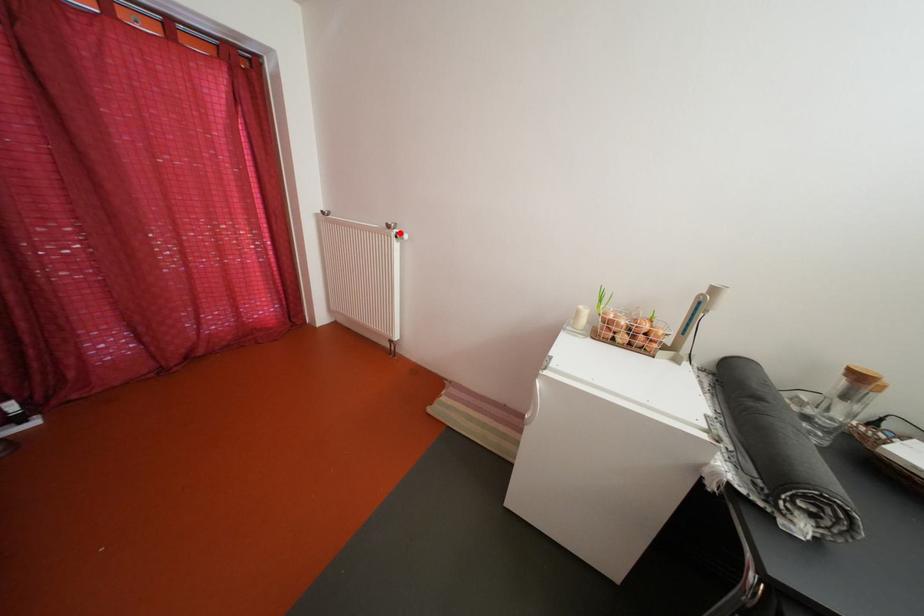
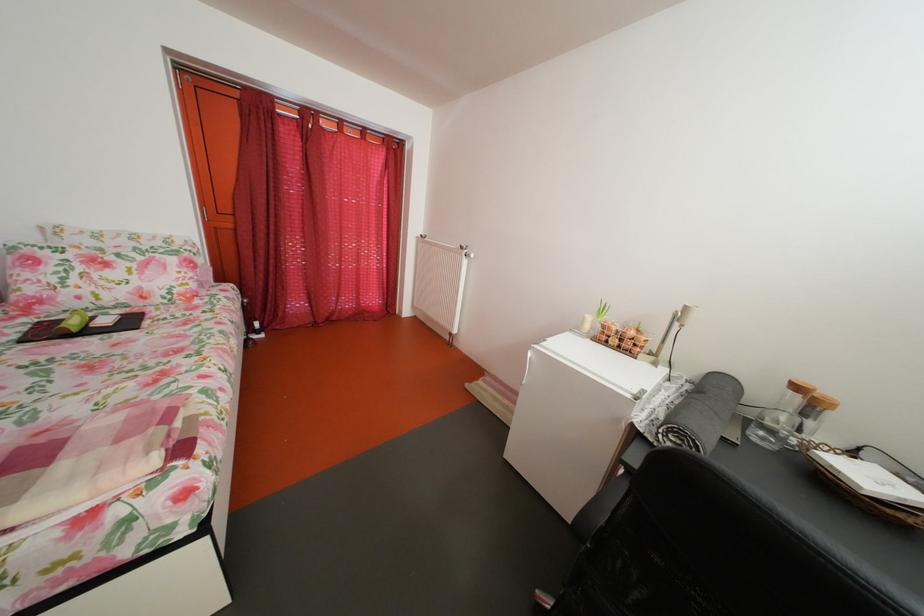
Where in the second image is the point corresponding to the highlighted location from the first image?

(473, 254)